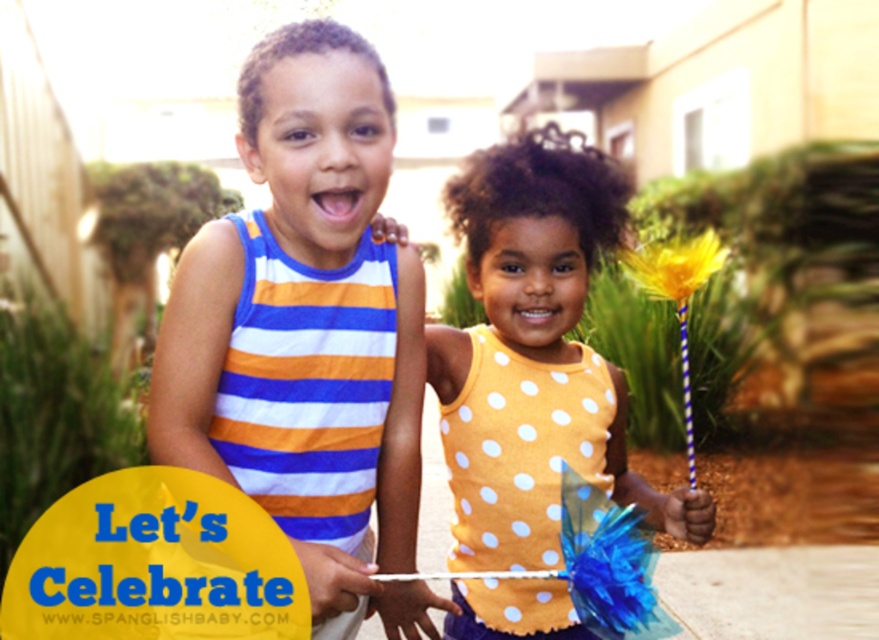
You are a photographer trying to capture a closeup of the yellow paper flower at upper right without the yellow dotted tank top at center blocking it. Based on their positions, is this possible?

The yellow paper flower at upper right is behind the yellow dotted tank top at center, so it is blocked and cannot be captured without the tank top in the frame.

Based on the scene description, where is the yellow dotted tank top at center located in terms of coordinates?

The yellow dotted tank top at center is located at coordinates point (535, 356).

You are a photographer trying to capture the perfect shot of the two children in the scene. You notice two specific points marked as point 1 at coordinates point (231, 317) and point 2 at coordinates point (631, 266). To ensure the best composition, you want to know which point is closer to the camera. Which point should you focus on?

Point (231, 317) is in front of point (631, 266), so you should focus on point (231, 317) to capture the closer one.